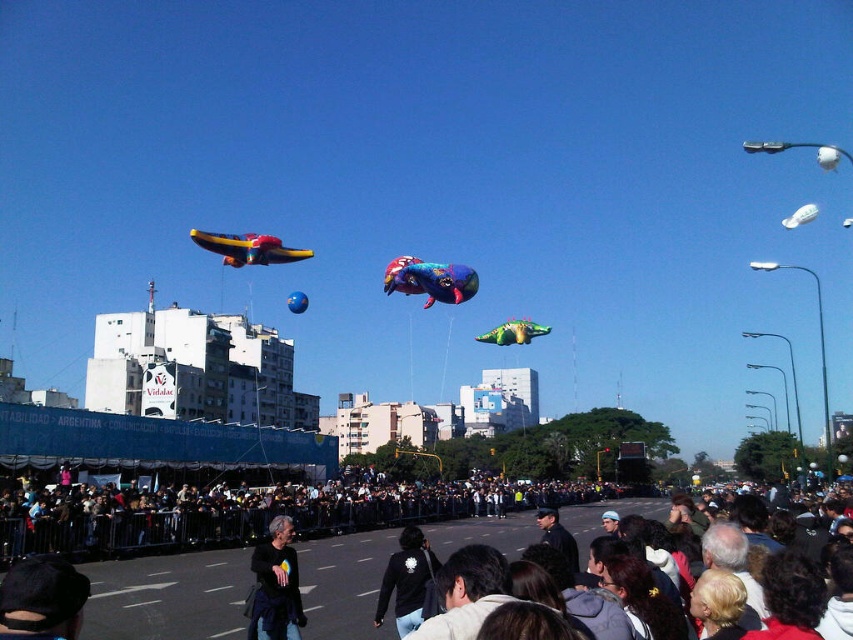
You are standing at the edge of the street and see the dark gray crowd at lower center and the black matte jacket at lower center. Which object is positioned to the left of the other?

The black matte jacket at lower center is positioned to the left of the dark gray crowd at lower center.